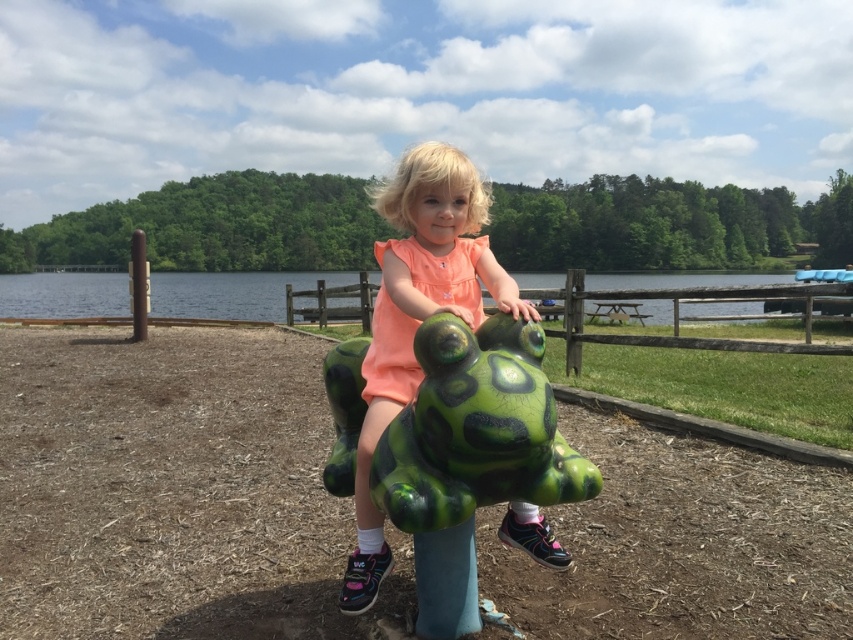
You are a photographer trying to capture the frog playground structure from the best angle. You have two markers placed at point (x=451, y=168) and point (x=36, y=304). Which marker is closer to your camera position?

Point (x=451, y=168) is closer to the camera than point (x=36, y=304).

You are a parent trying to locate your child who is playing in the park. You see the image and notice the matte green plastic frog at center. Based on the coordinates provided, can you determine if the frog is positioned exactly at the center of the image?

The 2D location of the matte green plastic frog at center is at point (416,314), which is very close to the center coordinates of (426,320). Therefore, the frog is positioned almost exactly at the center of the image.

You are a parent supervising a child at the park. You notice the child is standing on the matte green plastic frog at center. Is the child closer to the green plastic water at center or farther away from it?

The matte green plastic frog at center is below green plastic water at center, so the child standing on the frog is closer to the green plastic water at center.